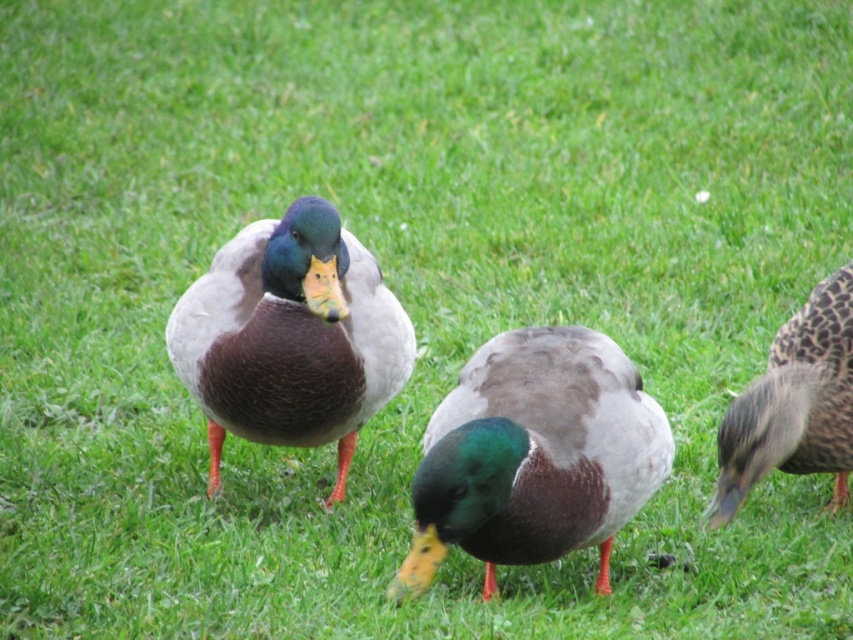
Question: Does green glossy duck at center lie in front of brown speckled feathers at right?

Choices:
 (A) yes
 (B) no

Answer: (A)

Question: Considering the real-world distances, which object is farthest from the shiny brown duck at center?

Choices:
 (A) brown speckled feathers at right
 (B) green glossy duck at center

Answer: (A)

Question: Which object appears farthest from the camera in this image?

Choices:
 (A) shiny brown duck at center
 (B) brown speckled feathers at right
 (C) green glossy duck at center

Answer: (B)

Question: Which point is closer to the camera taking this photo?

Choices:
 (A) (798, 445)
 (B) (502, 372)

Answer: (B)

Question: Is shiny brown duck at center behind brown speckled feathers at right?

Choices:
 (A) yes
 (B) no

Answer: (B)

Question: Does shiny brown duck at center have a greater width compared to brown speckled feathers at right?

Choices:
 (A) yes
 (B) no

Answer: (A)